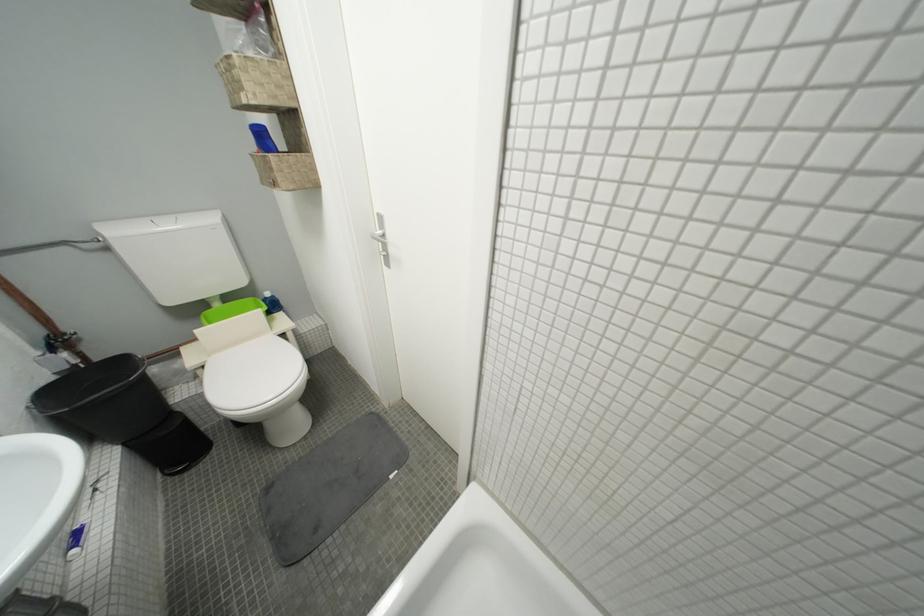
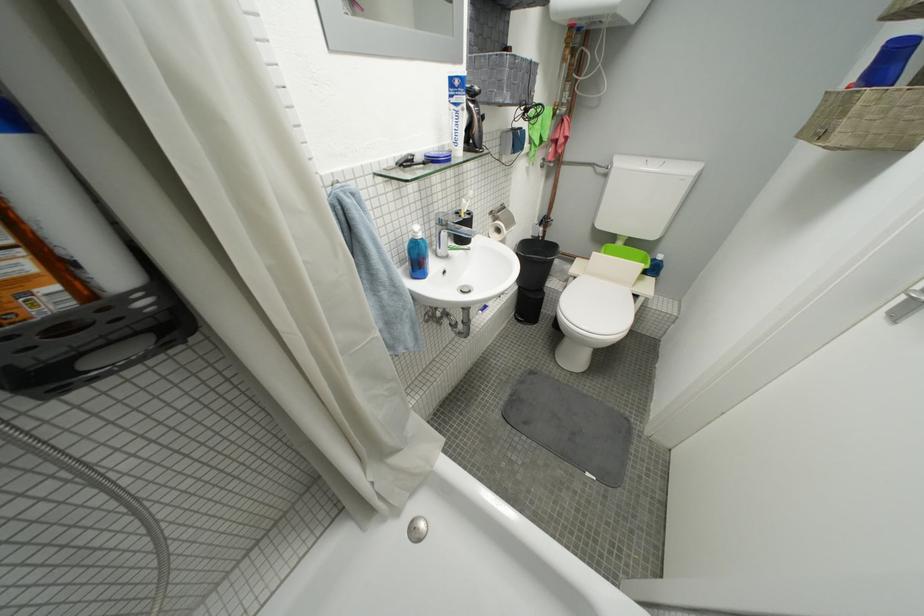
In the second image, find the point that corresponds to point (177, 229) in the first image.

(662, 169)